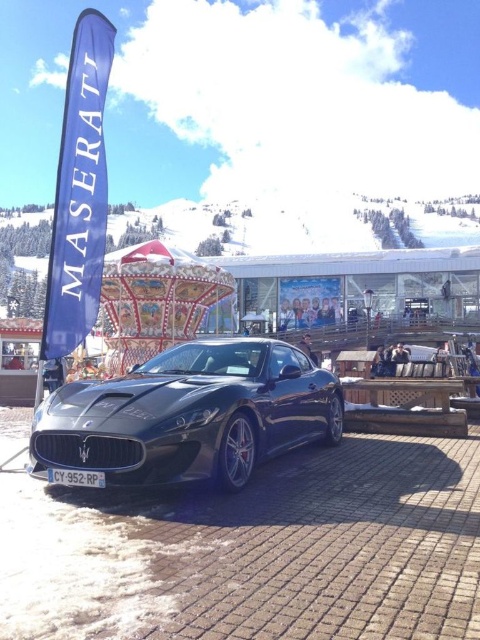
Is glossy black sports car at center in front of wooden picnic table at center?

Yes, it is in front of wooden picnic table at center.

The image size is (480, 640). I want to click on glossy black sports car at center, so click(187, 416).

Find the location of a particular element. The width and height of the screenshot is (480, 640). glossy black sports car at center is located at coordinates (187, 416).